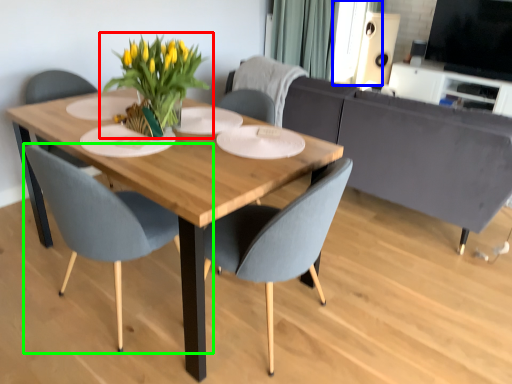
Question: Based on their relative distances, which object is farther from houseplant (highlighted by a red box)? Choose from window screen (highlighted by a blue box) and chair (highlighted by a green box).

Choices:
 (A) window screen
 (B) chair

Answer: (A)